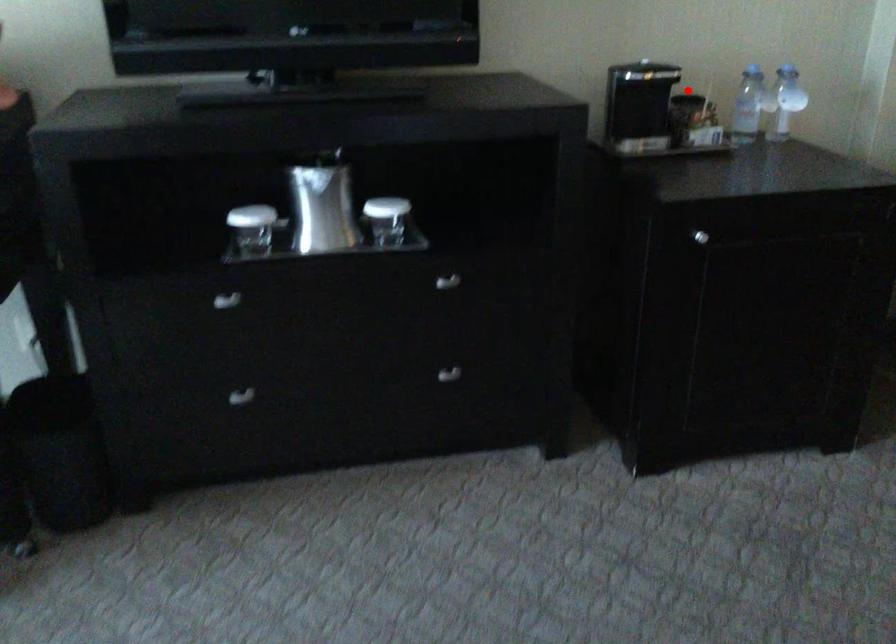
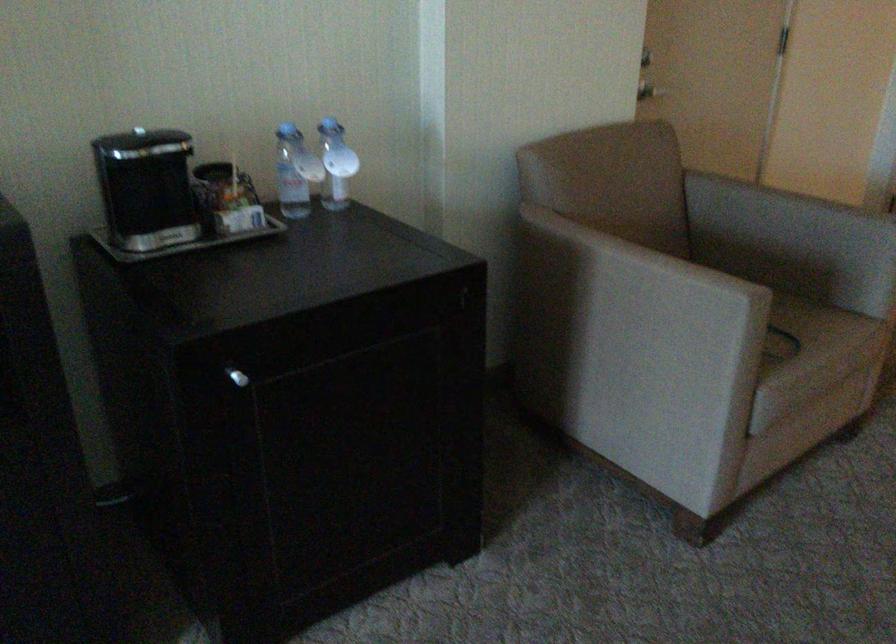
The point at the highlighted location is marked in the first image. Where is the corresponding point in the second image?

(212, 171)